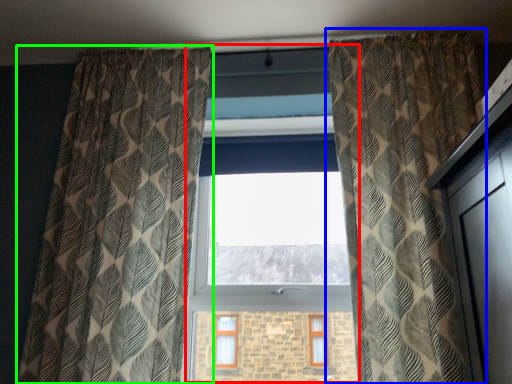
Question: Which object is positioned farthest from bay window (highlighted by a red box)? Select from curtain (highlighted by a blue box) and curtain (highlighted by a green box).

Choices:
 (A) curtain
 (B) curtain

Answer: (A)